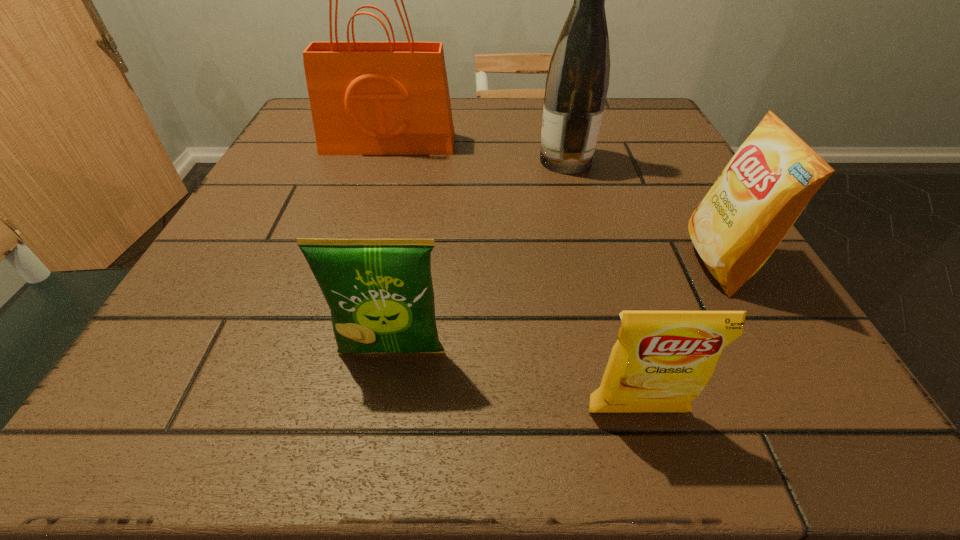
Locate an element on the screen. This screenshot has width=960, height=540. free space located 0.250m on the label of the second tallest object is located at coordinates (416, 160).

This screenshot has height=540, width=960. What are the coordinates of `vacant space located 0.250m on the label of the second tallest object` in the screenshot? It's located at point(416,160).

Locate an element on the screen. This screenshot has height=540, width=960. blank area located 0.090m on the front-facing side of the rightmost crisp (potato chip) is located at coordinates (632, 262).

Locate an element on the screen. vacant space located on the front-facing side of the rightmost crisp (potato chip) is located at coordinates (458, 262).

Where is `free space located 0.180m on the front-facing side of the rightmost crisp (potato chip)`? free space located 0.180m on the front-facing side of the rightmost crisp (potato chip) is located at coordinates (573, 262).

Locate an element on the screen. Image resolution: width=960 pixels, height=540 pixels. object that is at the far edge is located at coordinates (367, 98).

Find the location of `object located in the left edge section of the desktop`. object located in the left edge section of the desktop is located at coordinates (367, 98).

The image size is (960, 540). In order to click on object present at the right edge in this screenshot , I will do `click(759, 195)`.

Where is `object that is at the far left corner`? The image size is (960, 540). object that is at the far left corner is located at coordinates (367, 98).

In the image, there is a desktop. At what (x,y) coordinates should I click in order to perform the action: click on vacant space at the far edge. Please return your answer as a coordinate pair (x, y). Looking at the image, I should click on (504, 132).